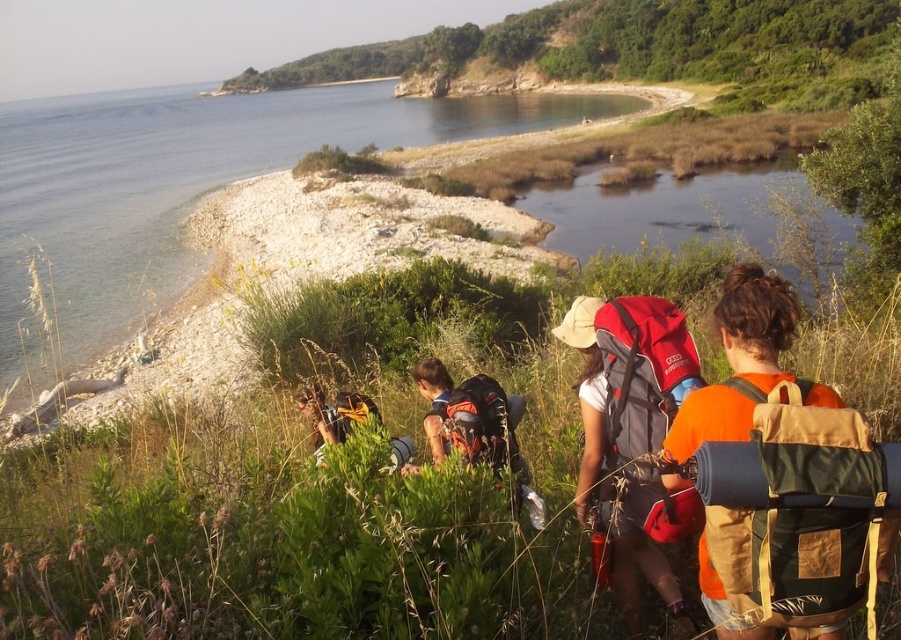
You are a hiker trying to locate your friend who is carrying the orange fabric backpack at center right. You see the brushed metal backpack at lower center. In which direction should you move to find your friend?

You should move to the right because the orange fabric backpack at center right is located to the right of the brushed metal backpack at lower center.

You are a hiker trying to locate your two backpacks on the slope. The orange fabric backpack at center right and the matte black backpack at center are both visible. Which backpack is positioned higher up on the slope?

The orange fabric backpack at center right is positioned higher up on the slope than the matte black backpack at center.